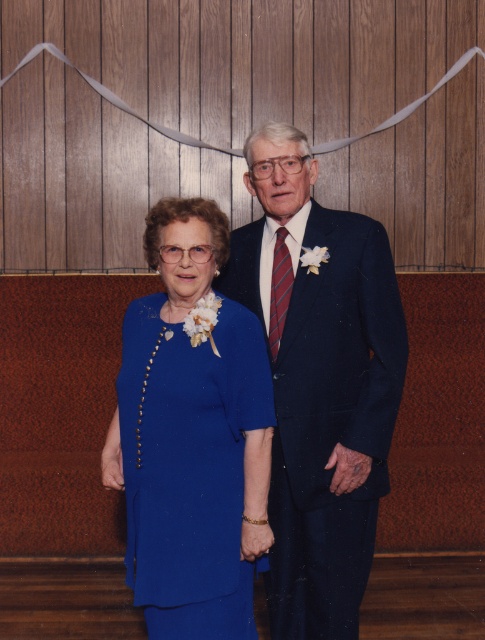
Question: Observing the image, what is the correct spatial positioning of navy wool suit at center in reference to matte blue dress at center?

Choices:
 (A) left
 (B) right

Answer: (B)

Question: Which of the following is the closest to the observer?

Choices:
 (A) tap(394, 344)
 (B) tap(179, 362)

Answer: (B)

Question: Which point is farther to the camera?

Choices:
 (A) (197, 449)
 (B) (275, 378)

Answer: (B)

Question: Which of the following is the closest to the observer?

Choices:
 (A) (384, 266)
 (B) (144, 541)

Answer: (B)

Question: Is navy wool suit at center positioned in front of matte blue dress at center?

Choices:
 (A) no
 (B) yes

Answer: (A)

Question: Is navy wool suit at center wider than matte blue dress at center?

Choices:
 (A) yes
 (B) no

Answer: (A)